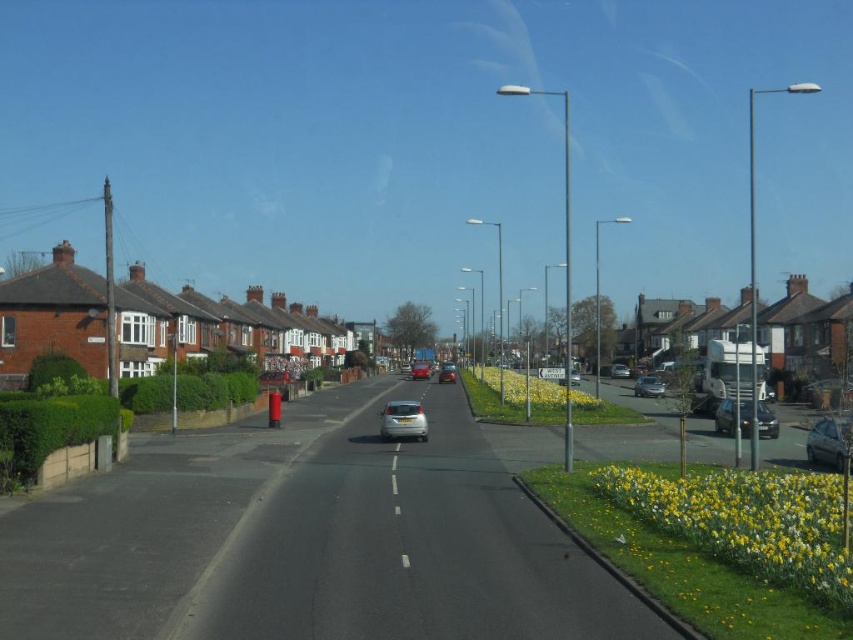
Question: Which point appears farthest from the camera in this image?

Choices:
 (A) (624, 364)
 (B) (560, 376)
 (C) (645, 392)

Answer: (A)

Question: Which object is closer to the camera taking this photo?

Choices:
 (A) matte silver car at center
 (B) satin black sedan at right
 (C) metallic silver car at center

Answer: (B)

Question: Which point is closer to the camera taking this photo?

Choices:
 (A) (415, 378)
 (B) (759, 433)
 (C) (821, 451)
 (D) (561, 384)

Answer: (C)

Question: Can you confirm if metallic silver car at right is wider than metallic silver car at center?

Choices:
 (A) no
 (B) yes

Answer: (B)

Question: Is satin black sedan at right positioned in front of matte silver car at center?

Choices:
 (A) no
 (B) yes

Answer: (B)

Question: Is metallic silver car at right bigger than matte silver car at center?

Choices:
 (A) no
 (B) yes

Answer: (B)